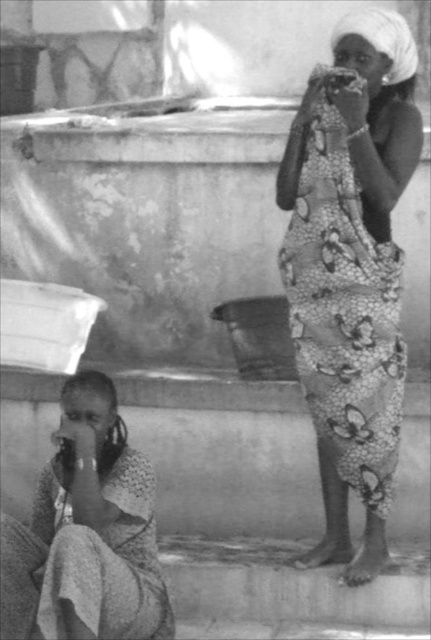
Does floral-patterned fabric at right have a greater height compared to patterned fabric cloth at lower left?

Yes.

Who is lower down, floral-patterned fabric at right or patterned fabric cloth at lower left?

patterned fabric cloth at lower left

Is point (309, 173) more distant than point (137, 468)?

Yes, point (309, 173) is behind point (137, 468).

Find the location of a particular element. floral-patterned fabric at right is located at coordinates (352, 275).